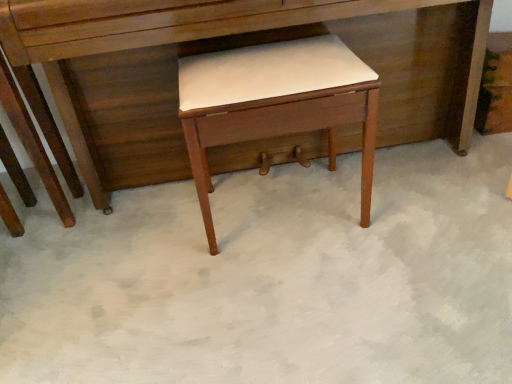
The height and width of the screenshot is (384, 512). I want to click on free area in between matte wood stool at center and matte wood desk at center, so click(293, 221).